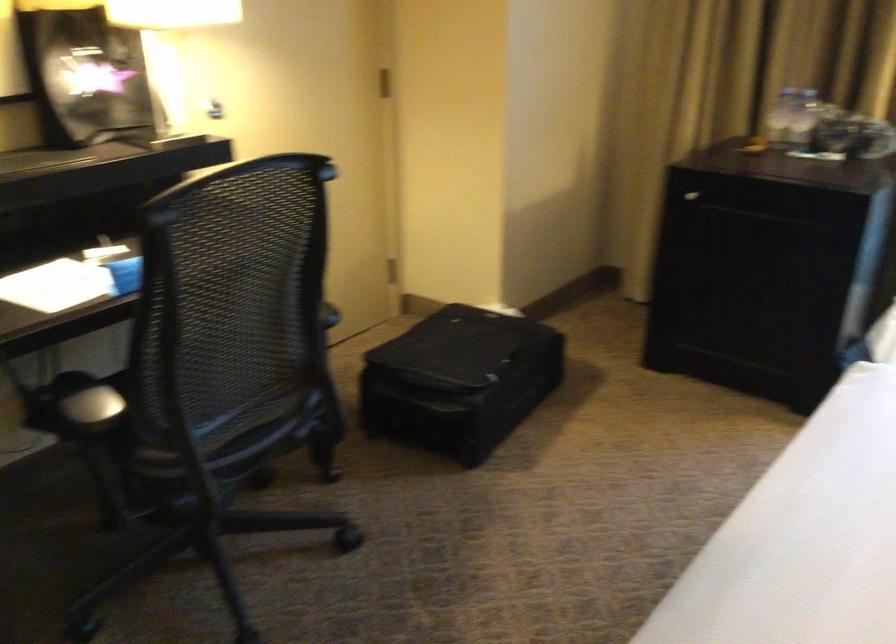
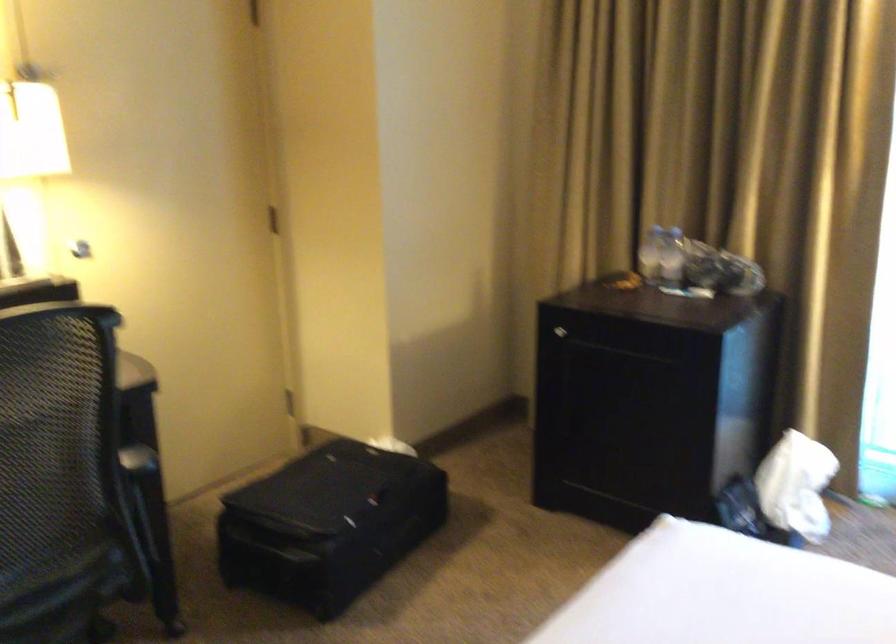
Question: Which direction would the cameraman need to move to produce the second image? Reply with the corresponding letter.

Choices:
 (A) Left
 (B) Right
 (C) Forward
 (D) Backward

Answer: (B)